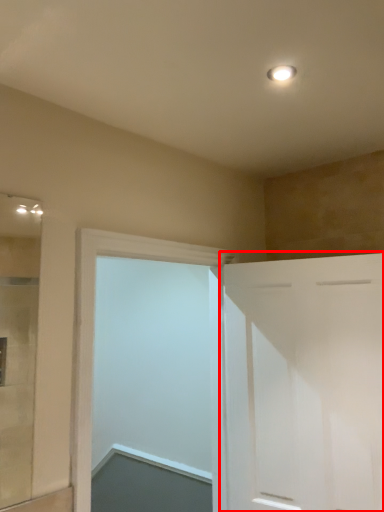
Question: From the image's perspective, what is the correct spatial positioning of door (annotated by the red box) in reference to door?

Choices:
 (A) below
 (B) above

Answer: (A)